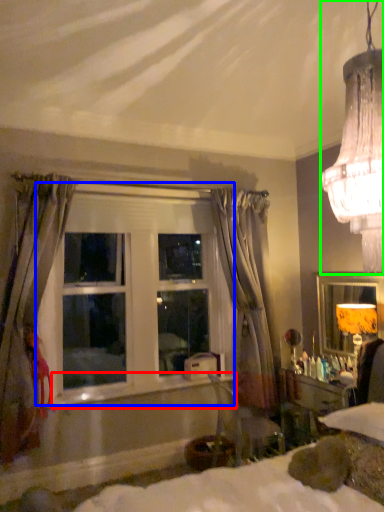
Question: Which object is the closest to the window sill (highlighted by a red box)? Choose among these: window (highlighted by a blue box) or lamp (highlighted by a green box).

Choices:
 (A) window
 (B) lamp

Answer: (A)